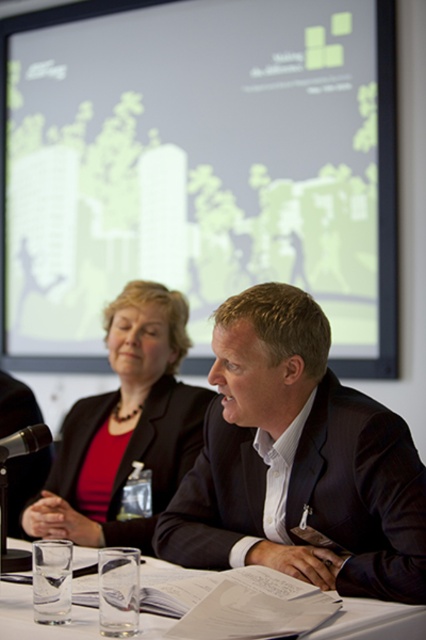
Who is shorter, dark suit at center or black plastic microphone at left?

With less height is black plastic microphone at left.

Is dark suit at center thinner than black plastic microphone at left?

In fact, dark suit at center might be wider than black plastic microphone at left.

Where is `dark suit at center`? dark suit at center is located at coordinates (296, 460).

Is dark suit at center wider than matte black blazer at center?

Yes.

Between point (330, 413) and point (166, 480), which one is positioned behind?

The point (166, 480) is behind.

Is point (203, 557) behind point (65, 529)?

No, it is not.

The image size is (426, 640). I want to click on dark suit at center, so click(x=296, y=460).

Does point (351, 637) come in front of point (40, 442)?

Yes, it is in front of point (40, 442).

Does clear glass at center have a lesser height compared to black plastic microphone at left?

Correct, clear glass at center is not as tall as black plastic microphone at left.

Is point (0, 602) more distant than point (14, 436)?

No, (0, 602) is closer to viewer.

The height and width of the screenshot is (640, 426). Identify the location of clear glass at center. (373, 621).